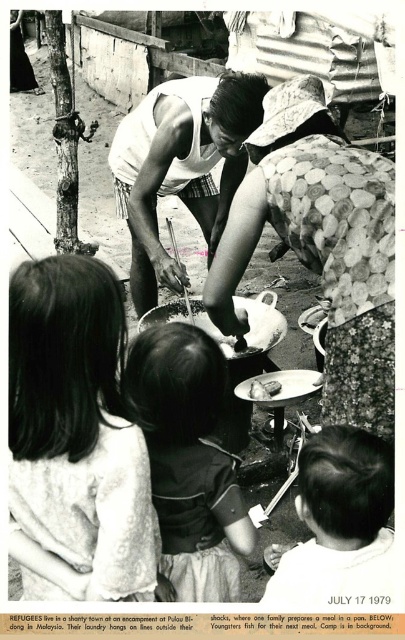
You are a photographer reviewing this historical image from 1979. You notice two items at the center of the scene. Which one is bigger between the matte white shirt at center and the smooth white plate at center?

The matte white shirt at center is larger in size compared to the smooth white plate at center.

You are a photographer observing this historical image from 1979. You notice two elements at the center of the scene. Which one is closer to the camera? The dark hair at center or the floral fabric dress at center?

The dark hair at center is in front of the floral fabric dress at center, so it is closer to the camera.

In the photograph, there are a matte white shirt at center and a smooth white plate at center. Which object is positioned to the left?

The matte white shirt at center is to the left of the smooth white plate at center.